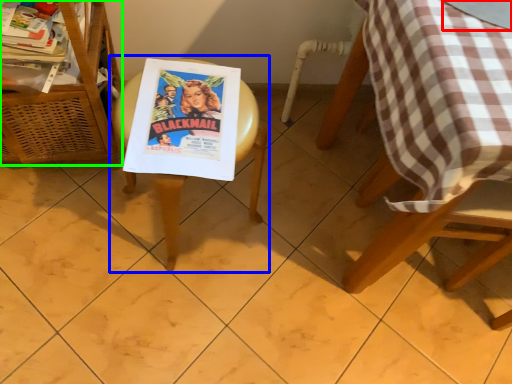
Question: Estimate the real-world distances between objects in this image. Which object is closer to glass table (highlighted by a red box), picnic table (highlighted by a blue box) or furniture (highlighted by a green box)?

Choices:
 (A) picnic table
 (B) furniture

Answer: (A)